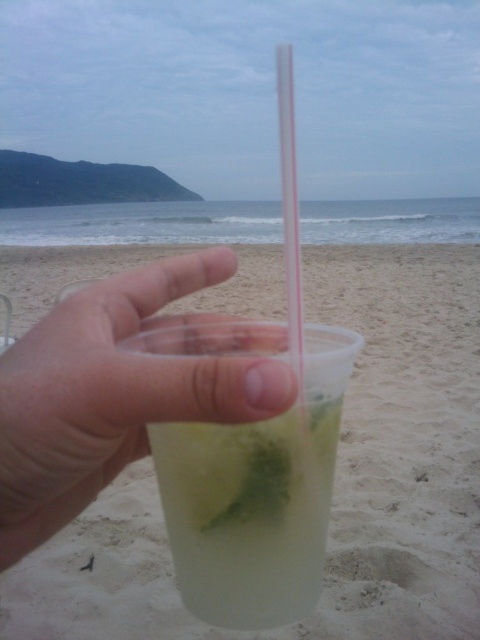
Question: Which object is closer to the camera taking this photo?

Choices:
 (A) translucent plastic cup at center
 (B) clear plastic cup at center
 (C) transparent plastic straw at center

Answer: (B)

Question: Is clear plastic cup at center to the right of transparent plastic straw at center from the viewer's perspective?

Choices:
 (A) no
 (B) yes

Answer: (A)

Question: Does translucent plastic cup at center have a larger size compared to transparent plastic straw at center?

Choices:
 (A) no
 (B) yes

Answer: (A)

Question: Does clear plastic cup at center have a lesser width compared to translucent plastic cup at center?

Choices:
 (A) yes
 (B) no

Answer: (B)

Question: Which object is the closest to the translucent plastic cup at center?

Choices:
 (A) transparent plastic straw at center
 (B) clear plastic cup at center

Answer: (B)

Question: Estimate the real-world distances between objects in this image. Which object is farther from the translucent plastic cup at center?

Choices:
 (A) clear plastic cup at center
 (B) transparent plastic straw at center

Answer: (B)